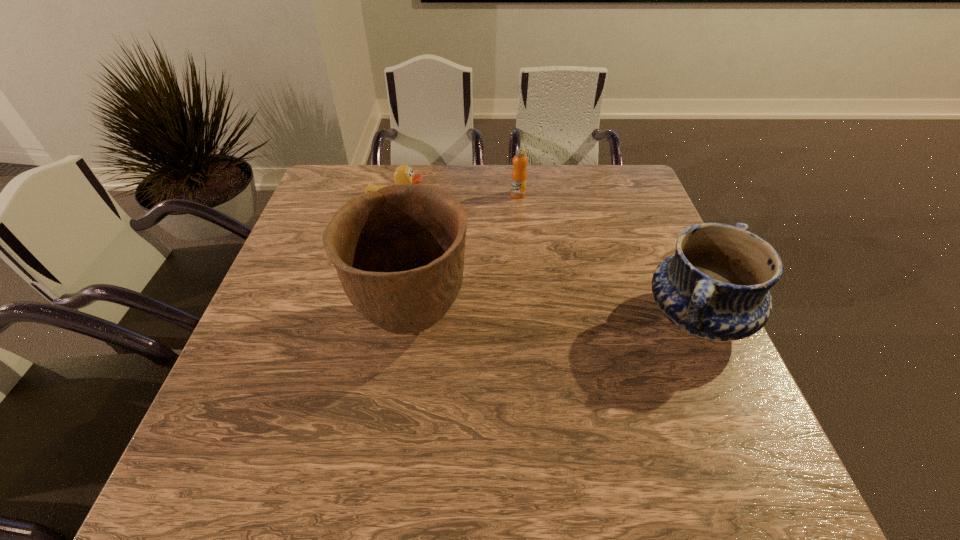
Where is `free space located 0.220m on the front label of the orange juice`? free space located 0.220m on the front label of the orange juice is located at coordinates (521, 247).

The width and height of the screenshot is (960, 540). Find the location of `free location located 0.300m on the front label of the orange juice`. free location located 0.300m on the front label of the orange juice is located at coordinates (523, 267).

I want to click on free space located at the beak of the duck, so tap(428, 227).

The width and height of the screenshot is (960, 540). I want to click on vacant space located at the beak of the duck, so click(475, 267).

Where is `vacant area situated at the beak of the duck`? The image size is (960, 540). vacant area situated at the beak of the duck is located at coordinates tap(507, 294).

The image size is (960, 540). Find the location of `orange juice that is at the far edge`. orange juice that is at the far edge is located at coordinates (519, 173).

Locate an element on the screen. duck that is positioned at the far edge is located at coordinates (403, 174).

What are the coordinates of `object that is at the right edge` in the screenshot? It's located at (716, 286).

I want to click on blank space at the near edge, so click(x=413, y=421).

Where is `vacant space at the left edge of the desktop`? vacant space at the left edge of the desktop is located at coordinates (272, 375).